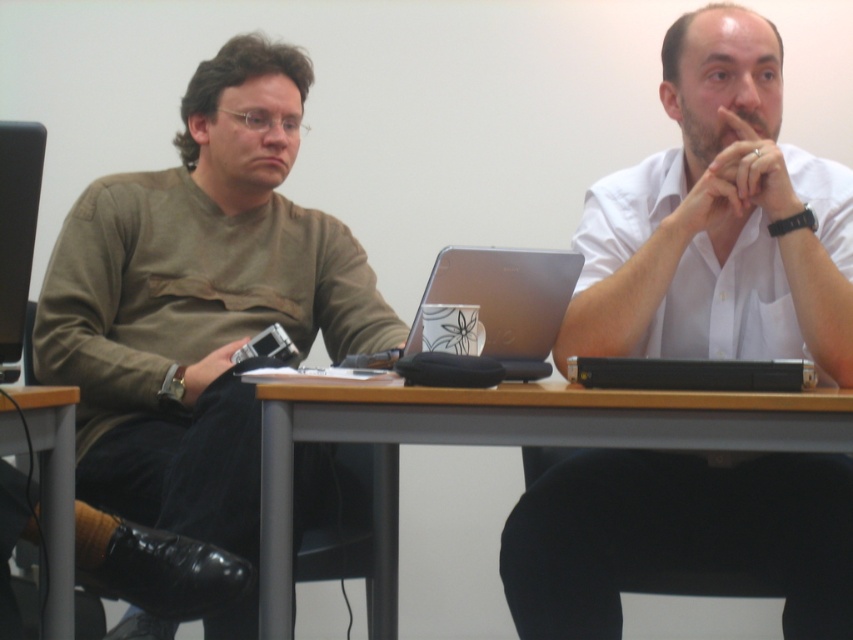
Question: Where is wooden at center located in relation to black plastic laptop at center in the image?

Choices:
 (A) below
 (B) above

Answer: (A)

Question: Among these points, which one is nearest to the camera?

Choices:
 (A) (674, 496)
 (B) (589, 381)

Answer: (B)

Question: Based on their relative distances, which object is farther from the wooden at center?

Choices:
 (A) black plastic laptop at left
 (B) white smooth shirt at center

Answer: (A)

Question: Which object is the closest to the white smooth shirt at center?

Choices:
 (A) silver metallic laptop at center
 (B) black plastic laptop at center
 (C) metallic gray table at lower left

Answer: (A)

Question: Is wooden at center wider than black plastic laptop at left?

Choices:
 (A) no
 (B) yes

Answer: (B)

Question: Considering the relative positions of wooden at center and metallic gray table at lower left in the image provided, where is wooden at center located with respect to metallic gray table at lower left?

Choices:
 (A) below
 (B) above

Answer: (B)